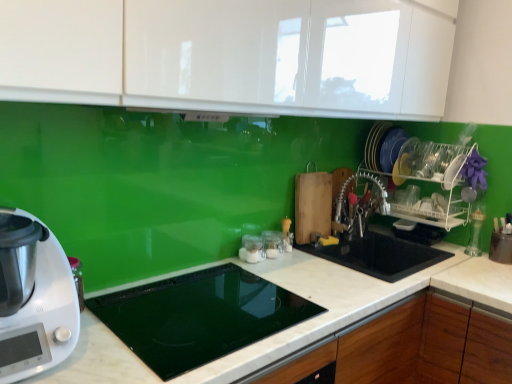
Locate an element on the screen. The image size is (512, 384). free space in front of clear glass jar at center, marked as the 2th appliance in a back-to-front arrangement is located at coordinates (251, 276).